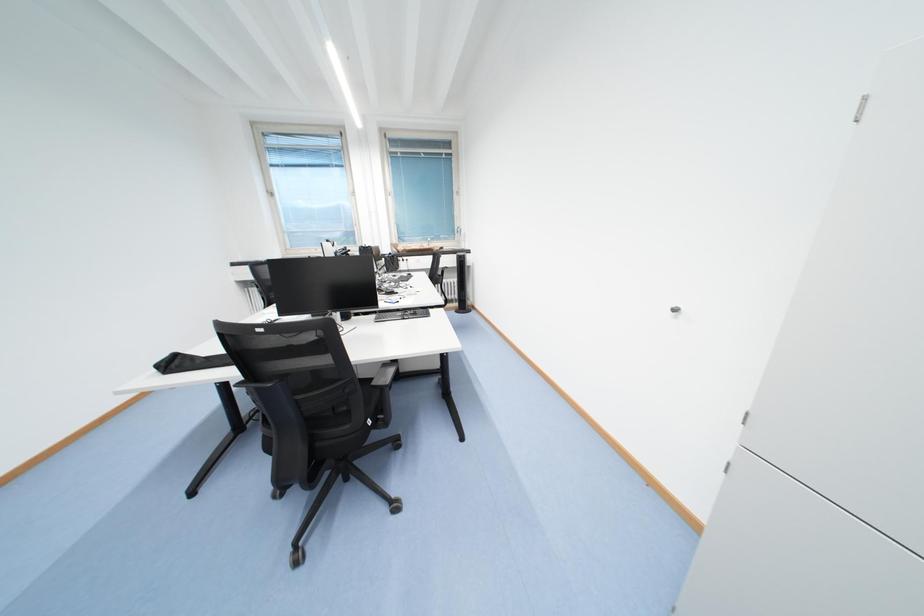
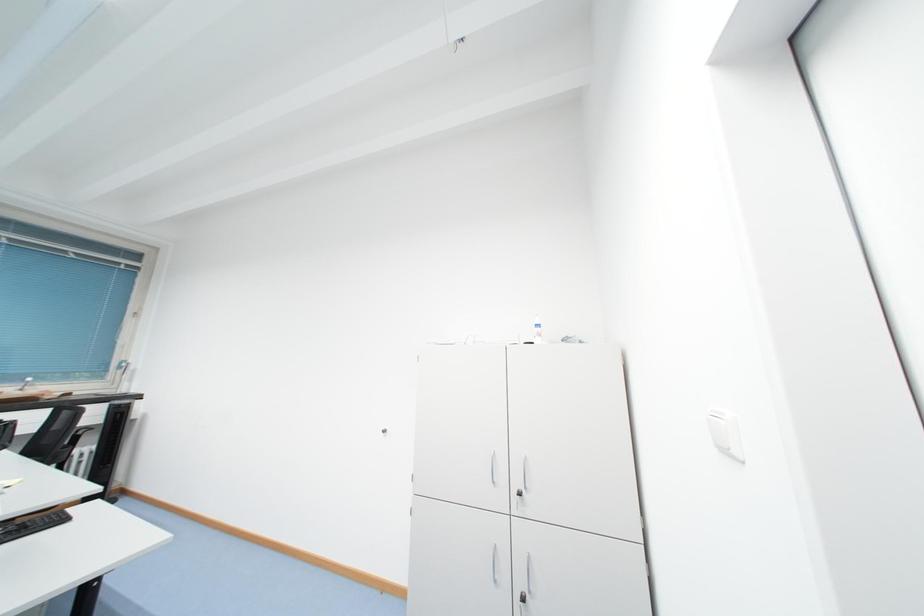
The first image is from the beginning of the video and the second image is from the end. How did the camera likely rotate when shooting the video?

The rotation direction of the camera is right-up.